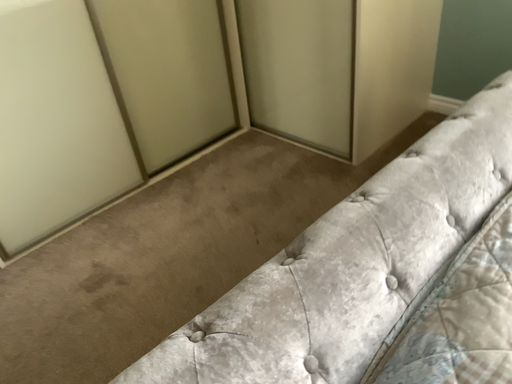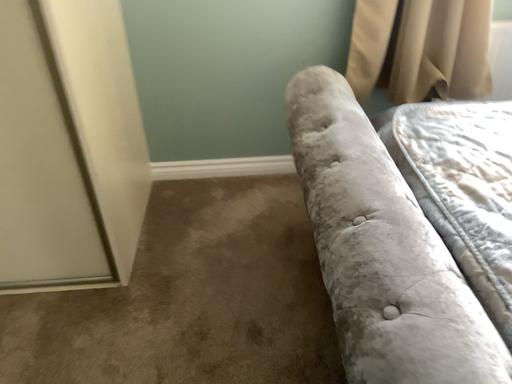
Question: How did the camera likely rotate when shooting the video?

Choices:
 (A) rotated left
 (B) rotated right

Answer: (B)